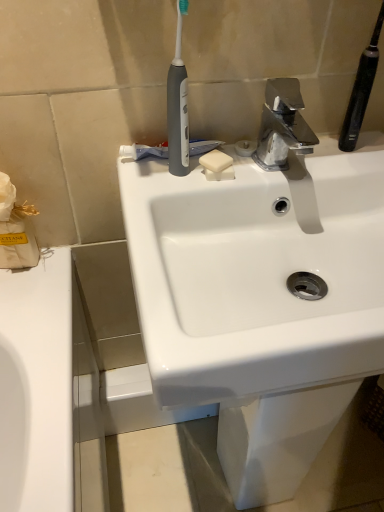
Question: In terms of height, does white glossy sink at center look taller or shorter compared to white matte soap at center?

Choices:
 (A) tall
 (B) short

Answer: (A)

Question: From the image's perspective, is white glossy sink at center located above or below white matte soap at center?

Choices:
 (A) below
 (B) above

Answer: (A)

Question: Which is farther from the gray matte toothbrush at upper center, which appears as the first toothbrush when viewed from the left?

Choices:
 (A) white paper tissue at left
 (B) white glossy sink at center
 (C) black rubberized toothbrush at upper right, placed as the 2th toothbrush when sorted from left to right
 (D) white matte soap at center
 (E) white matte toothpaste at center

Answer: (C)

Question: Based on their relative distances, which object is farther from the white paper tissue at left?

Choices:
 (A) gray matte toothbrush at upper center, which ranks as the second toothbrush in right-to-left order
 (B) white matte toothpaste at center
 (C) white matte soap at center
 (D) white glossy sink at center
 (E) polished chrome faucet at upper center

Answer: (E)